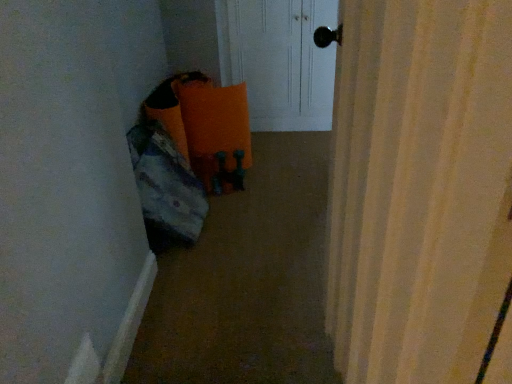
What do you see at coordinates (283, 62) in the screenshot?
I see `white glossy door at upper center` at bounding box center [283, 62].

Identify the location of white glossy door at upper center. 283,62.

This screenshot has width=512, height=384. What do you see at coordinates (247, 281) in the screenshot?
I see `carpeted floor at lower left` at bounding box center [247, 281].

What is the approximate width of carpeted floor at lower left?

carpeted floor at lower left is 5.27 feet in width.

The width and height of the screenshot is (512, 384). What are the coordinates of `carpeted floor at lower left` in the screenshot? It's located at (247, 281).

The image size is (512, 384). I want to click on white glossy door at upper center, so click(x=283, y=62).

Between carpeted floor at lower left and white glossy door at upper center, which one appears on the left side from the viewer's perspective?

From the viewer's perspective, carpeted floor at lower left appears more on the left side.

Is carpeted floor at lower left further to camera compared to white glossy door at upper center?

No, carpeted floor at lower left is in front of white glossy door at upper center.

Is point (241, 332) positioned before point (330, 103)?

That is True.

From the image's perspective, who appears lower, carpeted floor at lower left or white glossy door at upper center?

carpeted floor at lower left appears lower in the image.

From a real-world perspective, is carpeted floor at lower left positioned above or below white glossy door at upper center?

In terms of real-world spatial position, carpeted floor at lower left is below white glossy door at upper center.

Is carpeted floor at lower left wider than white glossy door at upper center?

Yes, carpeted floor at lower left is wider than white glossy door at upper center.

Can you confirm if carpeted floor at lower left is taller than white glossy door at upper center?

Incorrect, the height of carpeted floor at lower left is not larger of that of white glossy door at upper center.

From the picture: Which of these two, carpeted floor at lower left or white glossy door at upper center, is smaller?

carpeted floor at lower left is smaller.

Is carpeted floor at lower left spatially inside white glossy door at upper center, or outside of it?

carpeted floor at lower left is not inside white glossy door at upper center, it's outside.

Is carpeted floor at lower left directly adjacent to white glossy door at upper center?

No, carpeted floor at lower left is not with white glossy door at upper center.

Is carpeted floor at lower left looking in the opposite direction of white glossy door at upper center?

Yes, white glossy door at upper center is at the back of carpeted floor at lower left.

How many degrees apart are the facing directions of carpeted floor at lower left and white glossy door at upper center?

The angular difference between carpeted floor at lower left and white glossy door at upper center is 0.000683 degrees.

Identify the location of corridor lying on the left of white glossy door at upper center. This screenshot has width=512, height=384. (247, 281).

Between white glossy door at upper center and carpeted floor at lower left, which one appears on the right side from the viewer's perspective?

white glossy door at upper center.

Between white glossy door at upper center and carpeted floor at lower left, which one is positioned in front?

Positioned in front is carpeted floor at lower left.

Is point (237, 27) closer or farther from the camera than point (164, 301)?

Point (237, 27) is farther from the camera than point (164, 301).

From the image's perspective, is white glossy door at upper center below carpeted floor at lower left?

No.

From a real-world perspective, is white glossy door at upper center physically below carpeted floor at lower left?

Actually, white glossy door at upper center is physically above carpeted floor at lower left in the real world.

Can you confirm if white glossy door at upper center is wider than carpeted floor at lower left?

No, white glossy door at upper center is not wider than carpeted floor at lower left.

Considering the sizes of white glossy door at upper center and carpeted floor at lower left in the image, is white glossy door at upper center taller or shorter than carpeted floor at lower left?

In the image, white glossy door at upper center appears to be taller than carpeted floor at lower left.

Who is smaller, white glossy door at upper center or carpeted floor at lower left?

With smaller size is carpeted floor at lower left.

Is white glossy door at upper center located outside carpeted floor at lower left?

Yes, white glossy door at upper center is not within carpeted floor at lower left.

Is the surface of white glossy door at upper center in direct contact with carpeted floor at lower left?

No, white glossy door at upper center is not in contact with carpeted floor at lower left.

Based on the photo, is white glossy door at upper center turned away from carpeted floor at lower left?

No.

Can you tell me how much white glossy door at upper center and carpeted floor at lower left differ in facing direction?

There is a 0.000683-degree angle between the facing directions of white glossy door at upper center and carpeted floor at lower left.

Measure the distance from white glossy door at upper center to carpeted floor at lower left.

They are 1.23 meters apart.

I want to click on screen door located behind the carpeted floor at lower left, so click(x=283, y=62).

At what (x,y) coordinates should I click in order to perform the action: click on screen door behind the carpeted floor at lower left. Please return your answer as a coordinate pair (x, y). This screenshot has width=512, height=384. Looking at the image, I should click on (283, 62).

The image size is (512, 384). In the image, there is a white glossy door at upper center. In order to click on corridor below it (from the image's perspective) in this screenshot , I will do `click(247, 281)`.